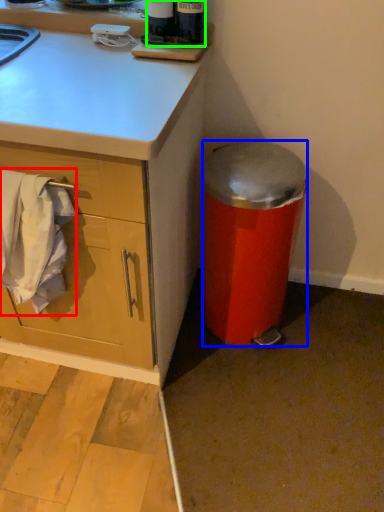
Question: Which is nearer to the laundry (highlighted by a red box)? trash bin/can (highlighted by a blue box) or bottle (highlighted by a green box).

Choices:
 (A) trash bin/can
 (B) bottle

Answer: (A)